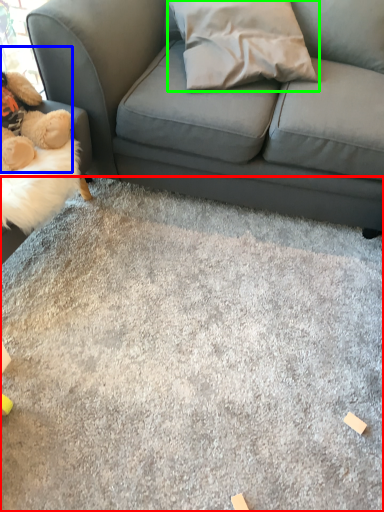
Question: Considering the real-world distances, which object is farthest from concrete (highlighted by a red box)? toy (highlighted by a blue box) or throw pillow (highlighted by a green box)?

Choices:
 (A) toy
 (B) throw pillow

Answer: (B)